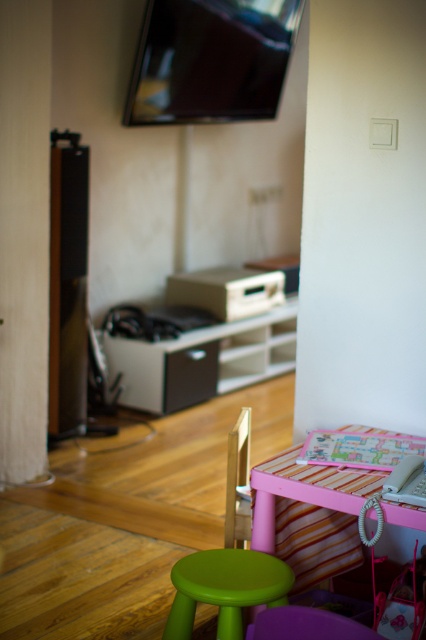
Question: Which point is farther from the camera taking this photo?

Choices:
 (A) (244, 493)
 (B) (218, 554)
 (C) (158, 348)

Answer: (C)

Question: Which object is positioned farthest from the white matte entertainment center at center?

Choices:
 (A) green matte stool at lower center
 (B) flat screen tv at upper center

Answer: (A)

Question: Does pink striped table at lower right lie behind purple plastic chair at lower center?

Choices:
 (A) no
 (B) yes

Answer: (B)

Question: Which point appears farthest from the camera in this image?

Choices:
 (A) [x=262, y=566]
 (B) [x=147, y=358]
 (C) [x=236, y=20]

Answer: (C)

Question: Does pink striped table at lower right appear under wooden chair at center?

Choices:
 (A) yes
 (B) no

Answer: (A)

Question: Is flat screen tv at upper center wider than purple plastic chair at lower center?

Choices:
 (A) no
 (B) yes

Answer: (B)